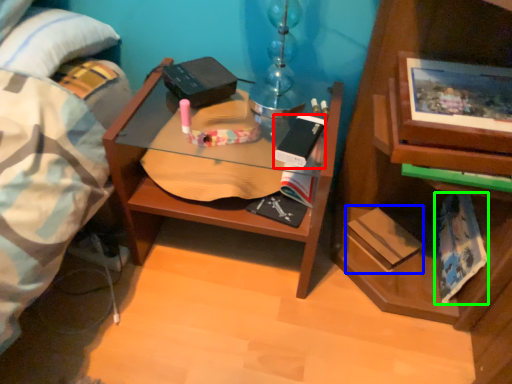
Question: Which is farther away from paperback book (highlighted by a red box)? paperback book (highlighted by a blue box) or paperback book (highlighted by a green box)?

Choices:
 (A) paperback book
 (B) paperback book

Answer: (B)